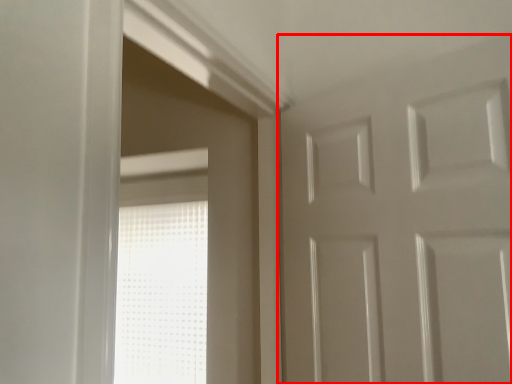
Question: From the image's perspective, considering the relative positions of door (annotated by the red box) and window in the image provided, where is door (annotated by the red box) located with respect to the staircase?

Choices:
 (A) below
 (B) above

Answer: (B)